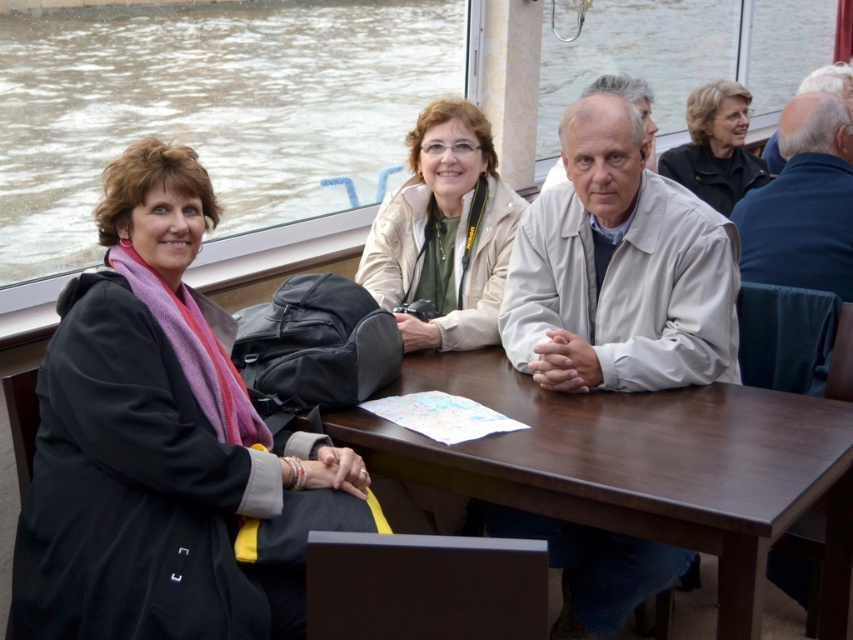
From the picture: Who is more forward, (294,122) or (607,540)?

Point (607,540) is in front.

Which is behind, point (679, 45) or point (656, 276)?

The point (679, 45) is more distant.

Where is `brown water at upper left`? The height and width of the screenshot is (640, 853). brown water at upper left is located at coordinates (212, 108).

Does dark blue jacket at right have a lesser width compared to gray hair at upper right?

Yes, dark blue jacket at right is thinner than gray hair at upper right.

Is dark blue jacket at right to the right of gray hair at upper right from the viewer's perspective?

No, dark blue jacket at right is not to the right of gray hair at upper right.

This screenshot has width=853, height=640. Describe the element at coordinates (804, 204) in the screenshot. I see `dark blue jacket at right` at that location.

Find the location of `dark blue jacket at right`. dark blue jacket at right is located at coordinates tap(804, 204).

Does brown wood table at center appear under dark blue jacket at right?

Indeed, brown wood table at center is positioned under dark blue jacket at right.

Between brown wood table at center and dark blue jacket at right, which one appears on the left side from the viewer's perspective?

Positioned to the left is brown wood table at center.

Does point (538, 458) lie behind point (787, 221)?

No, (538, 458) is closer to viewer.

Identify the location of brown wood table at center. (642, 468).